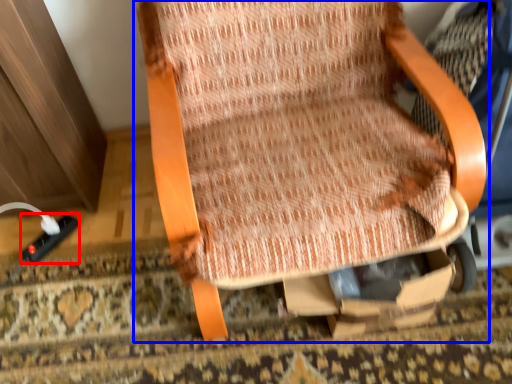
Question: Which object appears farthest to the camera in this image, plug (highlighted by a red box) or chair (highlighted by a blue box)?

Choices:
 (A) plug
 (B) chair

Answer: (A)